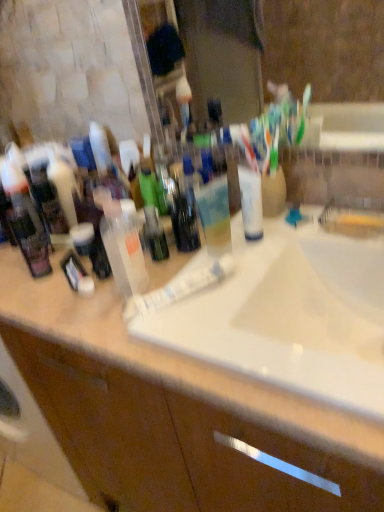
Where is `free spot in front of white matte jar at center-left, positioned as the fourth toiletry in left-to-right order`? free spot in front of white matte jar at center-left, positioned as the fourth toiletry in left-to-right order is located at coordinates (71, 304).